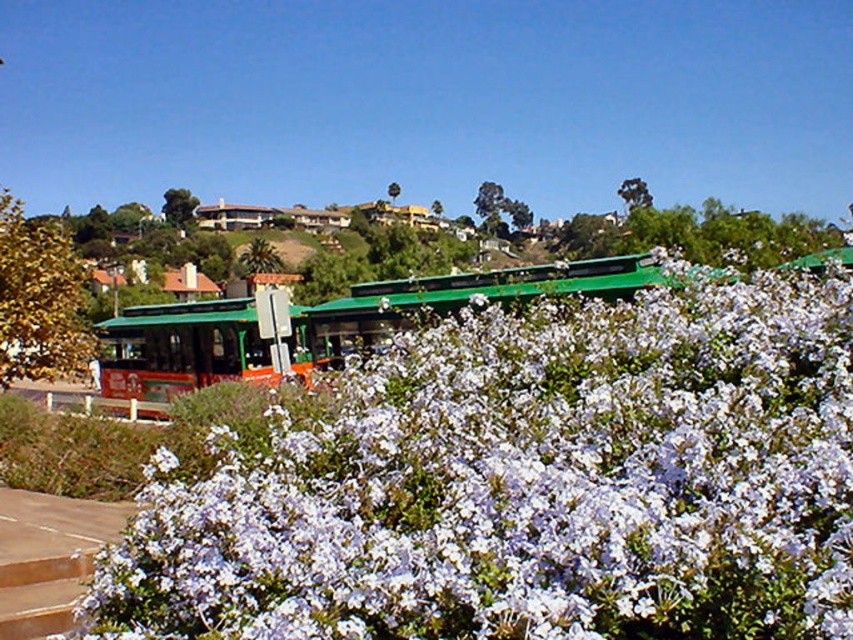
You are a gardener who wants to plant a new flower bed between the white matte flower at center and the green metallic bus stop at center. Since you want the new flowers to be taller than both existing ones, which existing object should you use as a reference for height?

The green metallic bus stop at center is taller than the white matte flower at center, so you should use the green metallic bus stop at center as the reference to ensure the new flowers are taller than both.

You are standing in the vibrant outdoor scene described. There is a point labeled at coordinates (531,484). What object is located at that point?

The point at coordinates (531,484) indicates a white matte flower at center.